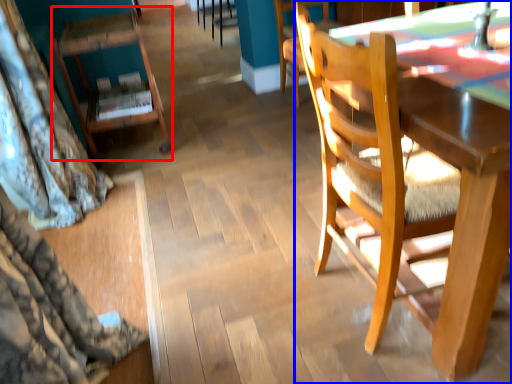
Question: Which object is further to the camera taking this photo, chair (highlighted by a red box) or chair (highlighted by a blue box)?

Choices:
 (A) chair
 (B) chair

Answer: (A)